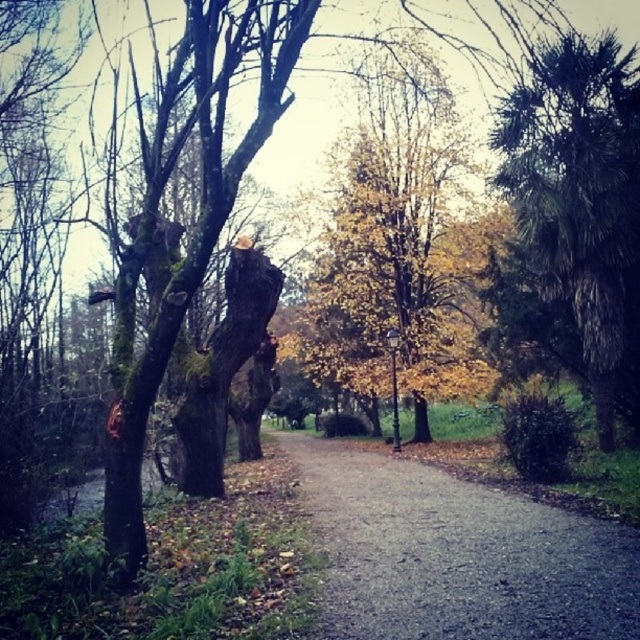
You are standing at point (404, 202) and want to walk to point (461, 586). Given that the path is 1.2 meters wide, can you walk directly towards your destination without stepping off the path?

Yes, you can walk directly towards point (461, 586) from point (404, 202) because the path is 1.2 meters wide, which should accommodate the straight path between them.

You are a park visitor standing on the winding dirt path. You see the yellow leafy tree at center and the green leafy palm at right. Which tree do you think is taller?

The green leafy palm at right is taller than the yellow leafy tree at center.